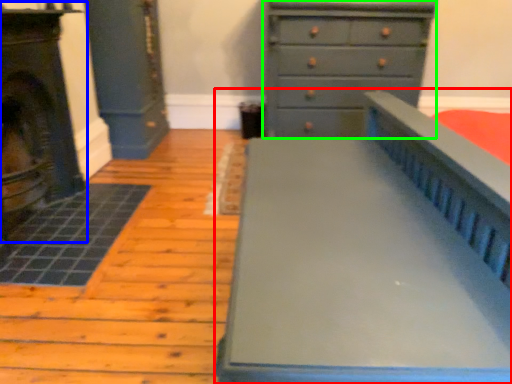
Question: Which object is positioned closest to furniture (highlighted by a red box)? Select from fireplace (highlighted by a blue box) and chest of drawers (highlighted by a green box).

Choices:
 (A) fireplace
 (B) chest of drawers

Answer: (A)